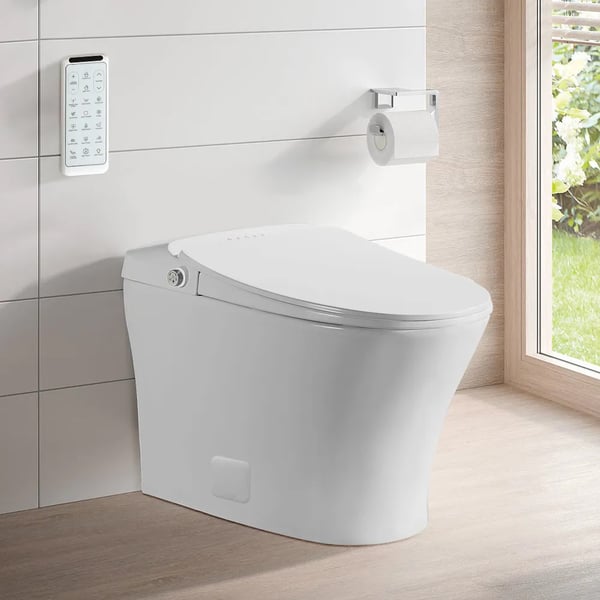
At what (x,y) coordinates should I click in order to perform the action: click on wall. Please return your answer as a coordinate pair (x, y). Image resolution: width=600 pixels, height=600 pixels. Looking at the image, I should click on (471, 60).